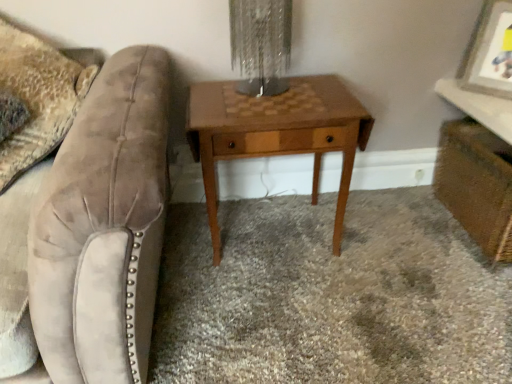
Find the location of a particular element. This screenshot has height=384, width=512. free location in front of metallic textured lampshade at center is located at coordinates (257, 112).